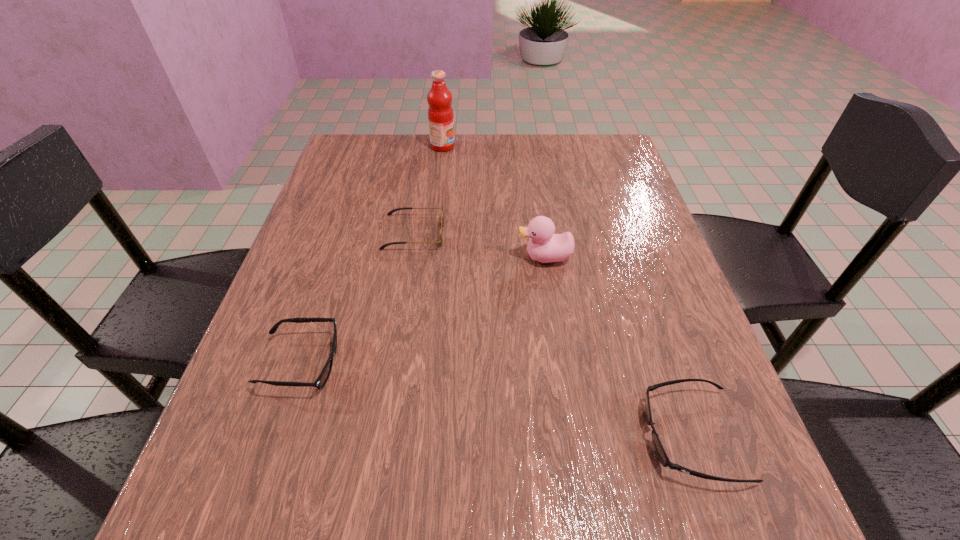
Identify the location of object that is at the near right corner. Image resolution: width=960 pixels, height=540 pixels. (659, 450).

Identify the location of free point at the far edge. The width and height of the screenshot is (960, 540). (519, 140).

I want to click on free region at the near edge of the desktop, so click(x=438, y=498).

This screenshot has height=540, width=960. Find the location of `vacant space at the left edge of the desktop`. vacant space at the left edge of the desktop is located at coordinates (295, 308).

Where is `free space at the right edge of the desktop`? This screenshot has width=960, height=540. free space at the right edge of the desktop is located at coordinates (610, 252).

You are a GUI agent. You are given a task and a screenshot of the screen. Output one action in this format:
    pyautogui.click(x=<x>, y=<y>)
    Task: Click on the free location at the far left corner of the desktop
    This screenshot has width=960, height=540.
    Given the screenshot: What is the action you would take?
    pyautogui.click(x=338, y=176)

In the image, there is a desktop. Where is `free space at the far right corner`? free space at the far right corner is located at coordinates (610, 168).

At what (x,y) coordinates should I click in order to perform the action: click on free area in between the leftmost object and the fourth shortest object. Please return your answer as a coordinate pair (x, y). The image size is (960, 540). Looking at the image, I should click on (423, 310).

Locate an element on the screen. The image size is (960, 540). free space between the rightmost sunglasses and the leftmost object is located at coordinates (496, 399).

I want to click on vacant point located between the tallest object and the second tallest object, so click(x=493, y=202).